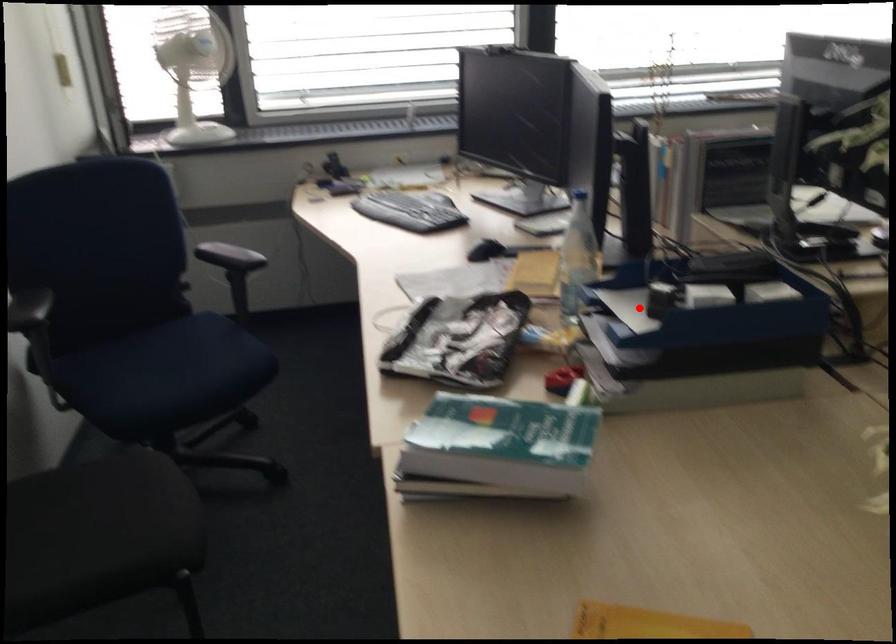
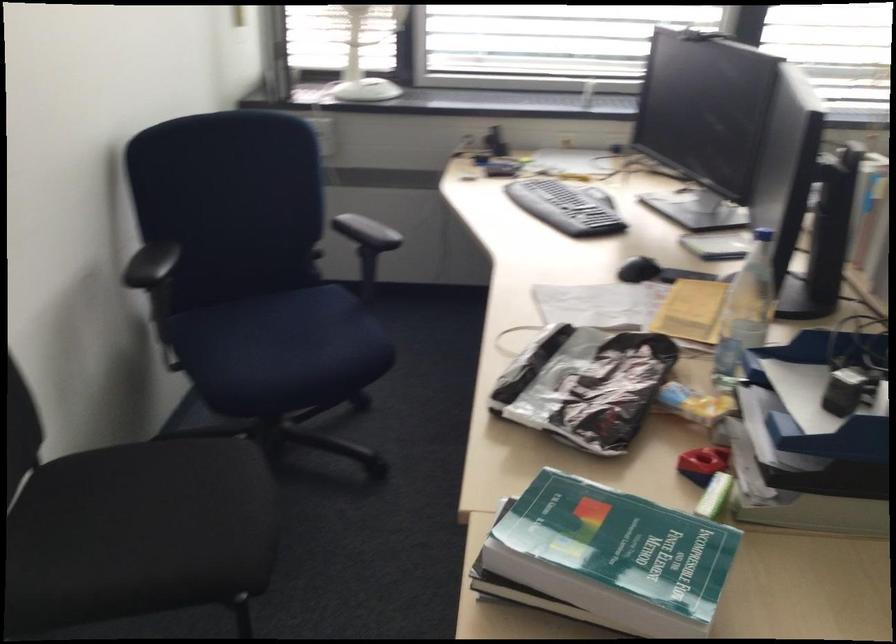
Locate, in the second image, the point that corresponds to the highlighted location in the first image.

(819, 395)